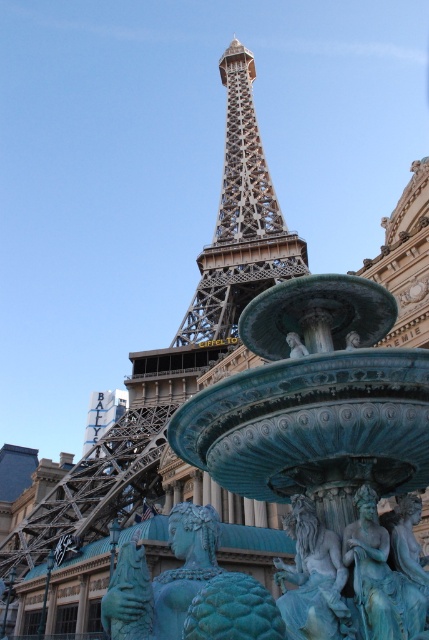
Does metallic brown eiffel tower at center have a greater width compared to teal patina mermaid at center?

Indeed, metallic brown eiffel tower at center has a greater width compared to teal patina mermaid at center.

Who is positioned more to the right, metallic brown eiffel tower at center or teal patina mermaid at center?

Positioned to the right is metallic brown eiffel tower at center.

Who is more forward, (244, 92) or (208, 520)?

Positioned in front is point (208, 520).

Identify the location of metallic brown eiffel tower at center. Image resolution: width=429 pixels, height=640 pixels. point(239,220).

Is point (232, 241) positioned after point (328, 573)?

Yes, point (232, 241) is behind point (328, 573).

Is metallic brown eiffel tower at center to the right of teal stone lion at center from the viewer's perspective?

Indeed, metallic brown eiffel tower at center is positioned on the right side of teal stone lion at center.

Locate an element on the screen. metallic brown eiffel tower at center is located at coordinates (239, 220).

Identify the location of metallic brown eiffel tower at center. This screenshot has width=429, height=640. (239, 220).

Is metallic brown eiffel tower at center positioned behind green patina statue at center?

Yes, metallic brown eiffel tower at center is further from the viewer.

Does metallic brown eiffel tower at center appear on the left side of green patina statue at center?

Correct, you'll find metallic brown eiffel tower at center to the left of green patina statue at center.

Between point (226, 333) and point (368, 573), which one is positioned behind?

The point (226, 333) is more distant.

I want to click on metallic brown eiffel tower at center, so click(x=239, y=220).